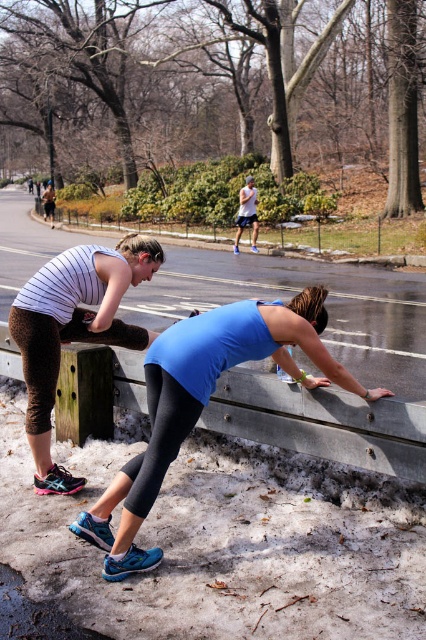
Consider the image. You are a photographer trying to capture both the blue matte tank top at center and the matte black tank top at left in a single shot. Based on their positions, which tank top is lower in the frame?

The blue matte tank top at center is located below the matte black tank top at left, so it is lower in the frame.